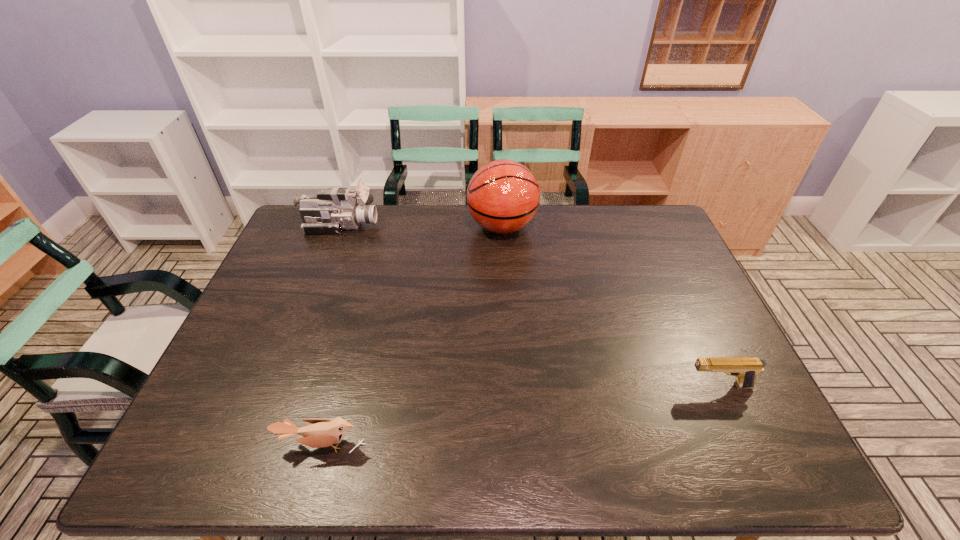
This screenshot has height=540, width=960. In order to click on vacant position at the left edge of the desktop in this screenshot , I will do `click(264, 314)`.

I want to click on blank space at the right edge of the desktop, so click(668, 285).

At what (x,y) coordinates should I click in order to perform the action: click on free area in between the camcorder and the second nearest object. Please return your answer as a coordinate pair (x, y). The height and width of the screenshot is (540, 960). Looking at the image, I should click on (530, 306).

Find the location of a particular element. The image size is (960, 540). free space that is in between the nearest object and the third object from left to right is located at coordinates (412, 336).

Find the location of a particular element. The width and height of the screenshot is (960, 540). free spot between the camcorder and the rightmost object is located at coordinates (530, 306).

Where is `free space between the basketball and the camcorder`? free space between the basketball and the camcorder is located at coordinates (421, 226).

What are the coordinates of `empty space that is in between the bird and the camcorder` in the screenshot? It's located at (331, 335).

Where is `free area in between the nearest object and the pistol`? This screenshot has width=960, height=540. free area in between the nearest object and the pistol is located at coordinates (520, 415).

Identify the location of vacant area that lies between the nearest object and the camcorder. (331, 335).

The width and height of the screenshot is (960, 540). Identify the location of vacant area between the second tallest object and the nearest object. (331, 335).